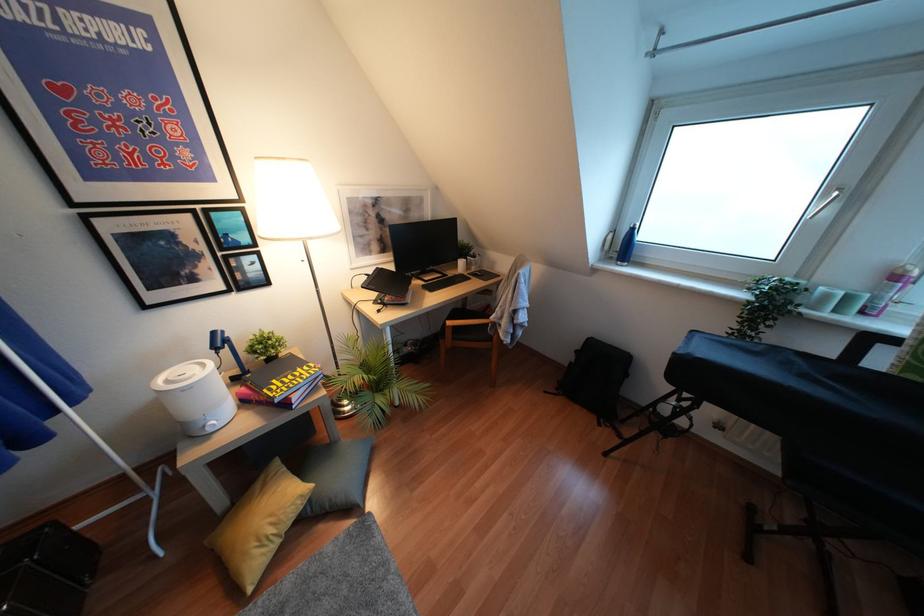
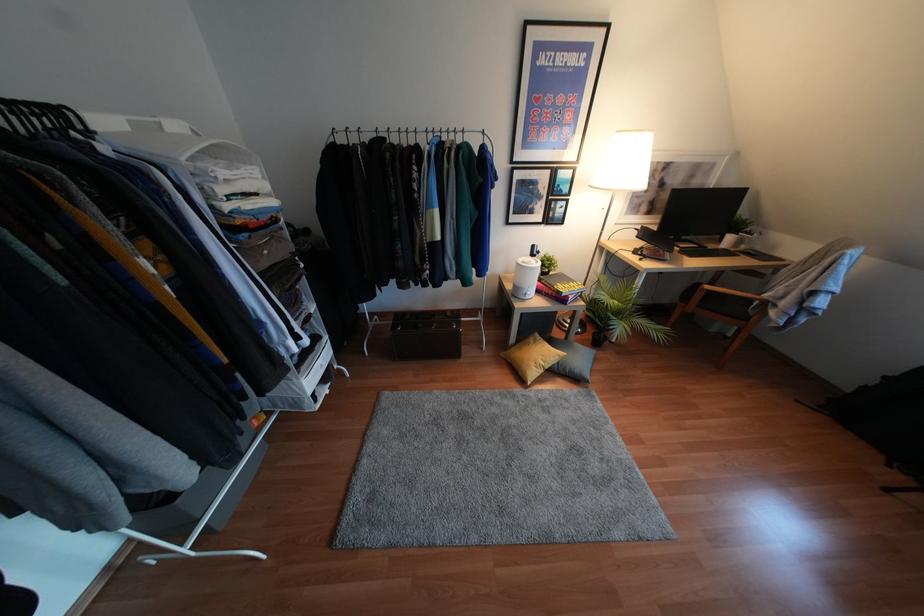
Locate, in the second image, the point that corresponds to [271,530] in the first image.

(541, 363)